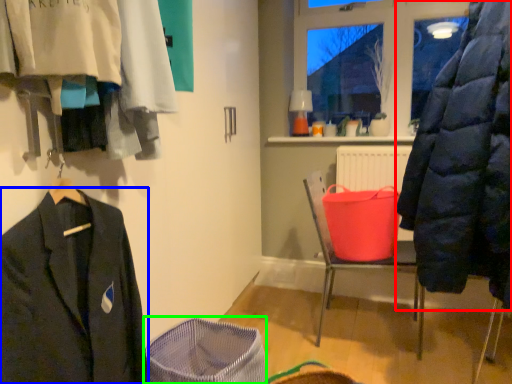
Question: Estimate the real-world distances between objects in this image. Which object is farther from coat (highlighted by a red box), suit (highlighted by a blue box) or basket container (highlighted by a green box)?

Choices:
 (A) suit
 (B) basket container

Answer: (A)